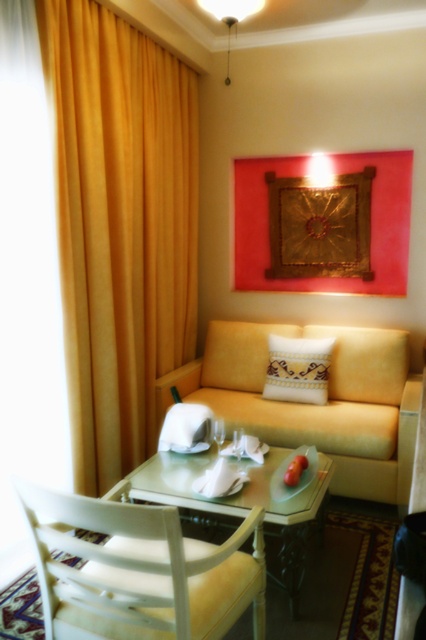
You are a delivery person who needs to place a 1.5 meter long package between the yellow velvet curtain at left and the gold textured fabric at upper center. Can the package fit in the space between them?

The distance between the yellow velvet curtain at left and the gold textured fabric at upper center is 1.03 meters. Since the package is 1.5 meters long, it cannot fit in the space between them.

You are standing in the hotel room and want to open the window to let some fresh air in. The window is covered by the yellow velvet curtain at left. Where should you go to reach the window? Please provide the coordinates in the format of point coordinates like point 0.355, 0.284

The yellow velvet curtain at left is located at point (120, 227). To reach the window, you should go to that coordinate since the curtain is covering the window.

You are a guest in this room and want to place a small lamp on the light wood table at center without covering the gold textured fabric at upper center. Is there enough space?

The gold textured fabric at upper center occupies less space than the light wood table at center, so there is enough space to place the lamp on the light wood table at center without covering the gold textured fabric at upper center.